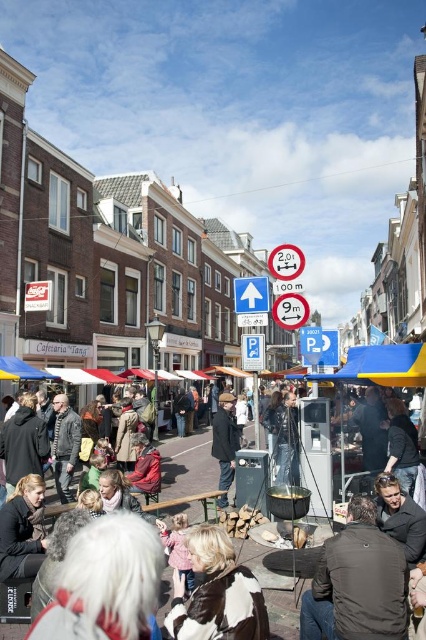
You are a tourist standing at the entrance of the street, looking towards the buildings. You see a dark gray jacket at center and a blue fabric canopy at lower left. Which object is closer to your right side?

The dark gray jacket at center is to the right of the blue fabric canopy at lower left, so the dark gray jacket at center is closer to your right side.

You are a delivery person trying to navigate through the street. You see a dark brown leather jacket at lower center and a yellow fabric canopy at center. Which object is closer to you as you walk along the street?

The dark brown leather jacket at lower center is closer to you because it is in front of the yellow fabric canopy at center.

You are a photographer standing at the edge of the street. You want to take a photo of the dark gray jacket at center and the blue fabric canopy at lower left. However, you notice that one of the objects is much taller than the other. Which object should you adjust your camera angle to focus on to ensure both are visible in the frame?

The dark gray jacket at center is much taller than the blue fabric canopy at lower left. To ensure both are visible in the frame, you should adjust your camera angle to focus on the dark gray jacket at center, as it is taller and might require a wider or higher angle to capture both objects properly.